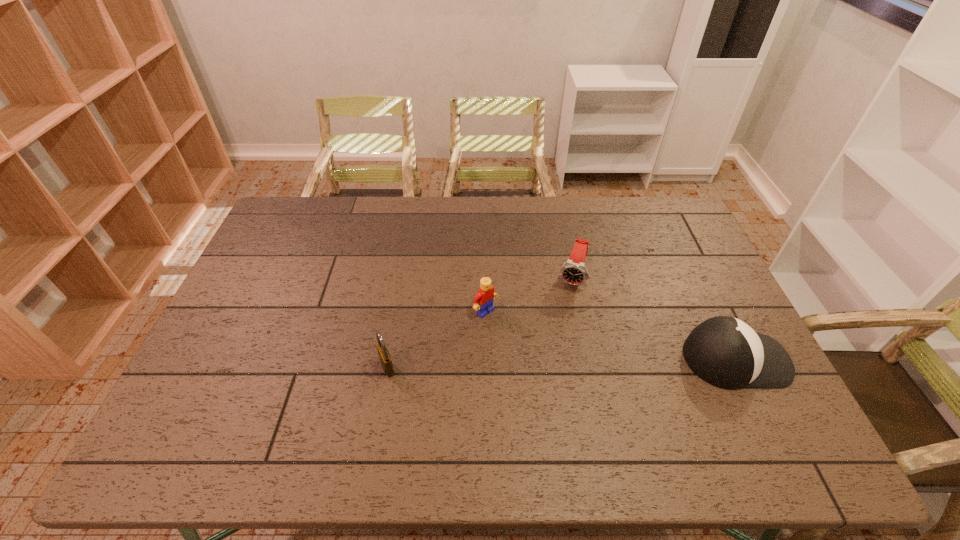
Identify the location of vacant space on the desktop that is between the leftmost object and the cap and is positioned on the face of the third object from right to left. (548, 363).

The width and height of the screenshot is (960, 540). Identify the location of vacant space on the desktop that is between the padlock and the cap and is positioned on the face of the third object from left to right. (544, 363).